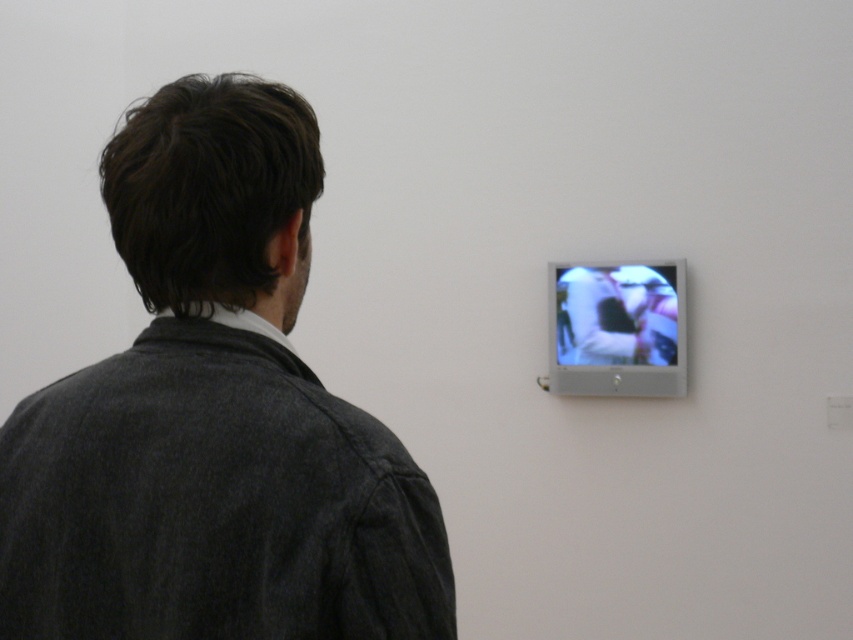
Question: Which of the following is the farthest from the observer?

Choices:
 (A) pyautogui.click(x=604, y=280)
 (B) pyautogui.click(x=248, y=410)

Answer: (A)

Question: Does dark gray woolen jacket at center come behind matte silver screen at upper right?

Choices:
 (A) yes
 (B) no

Answer: (B)

Question: Which point is farther to the camera?

Choices:
 (A) (608, 298)
 (B) (161, 262)

Answer: (A)

Question: Does dark gray woolen jacket at center have a lesser width compared to matte silver screen at upper right?

Choices:
 (A) yes
 (B) no

Answer: (B)

Question: Does dark gray woolen jacket at center have a smaller size compared to matte silver screen at upper right?

Choices:
 (A) no
 (B) yes

Answer: (A)